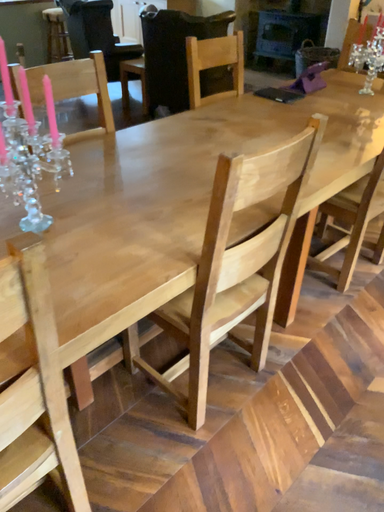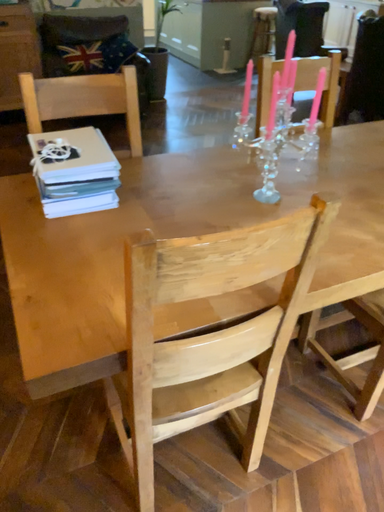
Question: How did the camera likely rotate when shooting the video?

Choices:
 (A) rotated right
 (B) rotated left

Answer: (B)